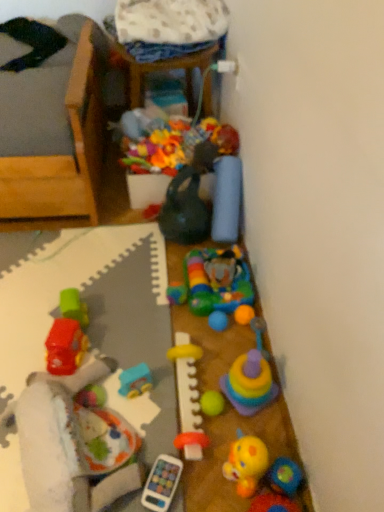
Where is `free location to the left of rubberized plastic stacking cups at center-right, which is counted as the 3th toy, starting from the right`? free location to the left of rubberized plastic stacking cups at center-right, which is counted as the 3th toy, starting from the right is located at coordinates (190, 377).